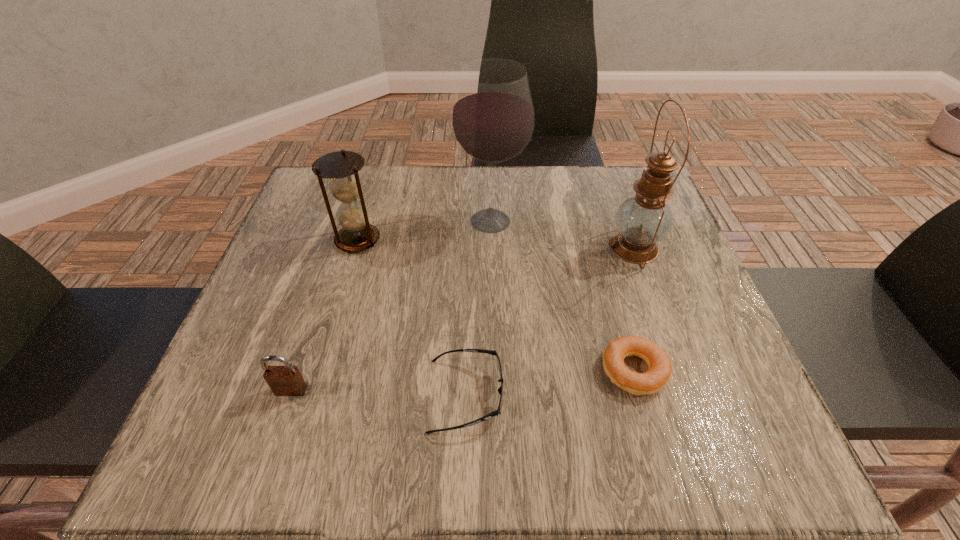
You are a GUI agent. You are given a task and a screenshot of the screen. Output one action in this format:
    pyautogui.click(x=<x>, y=<y>)
    Task: Click on the alcohol
    This screenshot has width=960, height=540.
    Given the screenshot: What is the action you would take?
    pyautogui.click(x=492, y=119)

What are the coordinates of `oil lamp` in the screenshot? It's located at (642, 220).

Where is `hourglass`? This screenshot has height=540, width=960. hourglass is located at coordinates point(341,167).

Find the location of a particular element. This screenshot has height=540, width=960. the fourth tallest object is located at coordinates (287, 380).

You are a GUI agent. You are given a task and a screenshot of the screen. Output one action in this format:
    pyautogui.click(x=<x>, y=<y>)
    Task: Click on the sunglasses
    This screenshot has height=540, width=960.
    Given the screenshot: What is the action you would take?
    498,412

This screenshot has height=540, width=960. Identify the location of bagel. point(659,365).

You are a GUI agent. You are given a task and a screenshot of the screen. Output one action in this format:
    pyautogui.click(x=<x>, y=<y>)
    Task: Click on the blank space located on the front of the alcohol
    Image resolution: width=960 pixels, height=540 pixels.
    Given the screenshot: What is the action you would take?
    pyautogui.click(x=492, y=305)

Identify the location of free region located 0.240m on the left of the oil lamp. The width and height of the screenshot is (960, 540). (500, 248).

Identify the location of vacant region located 0.250m on the front of the third tallest object. (325, 350).

Where is `free space located 0.070m on the front-facing side of the fourth tallest object`? free space located 0.070m on the front-facing side of the fourth tallest object is located at coordinates (276, 437).